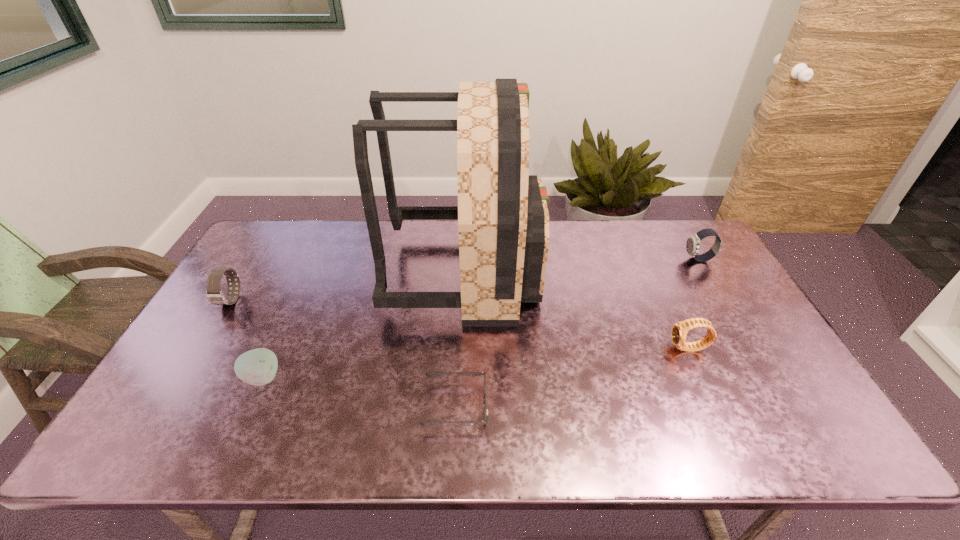
This screenshot has height=540, width=960. I want to click on vacant space located on the face of the farthest watch, so click(x=655, y=260).

The image size is (960, 540). I want to click on vacant space located 0.170m on the face of the farthest watch, so click(x=634, y=260).

I want to click on free space located on the face of the farthest watch, so click(x=628, y=260).

The image size is (960, 540). In order to click on vacant region located 0.140m on the face of the second nearest watch in this screenshot , I will do `click(200, 352)`.

Find the location of a particular element. Image resolution: width=960 pixels, height=540 pixels. vacant space situated on the face of the third nearest object is located at coordinates (525, 348).

What are the coordinates of `free point located on the face of the third nearest object` in the screenshot? It's located at (563, 348).

The image size is (960, 540). What are the coordinates of `free region located on the face of the third nearest object` in the screenshot? It's located at (574, 348).

The width and height of the screenshot is (960, 540). Find the location of `vacant area situated on the right of the apple`. vacant area situated on the right of the apple is located at coordinates (307, 378).

Identify the location of free space located on the temples of the sunglasses. Image resolution: width=960 pixels, height=540 pixels. (547, 406).

In order to click on backpack that is at the far edge in this screenshot , I will do `click(503, 221)`.